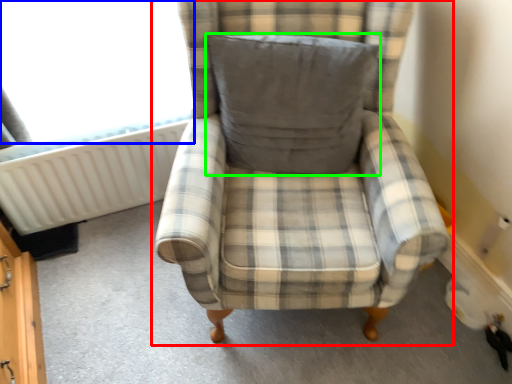
Question: Which object is the closest to the chair (highlighted by a red box)? Choose among these: window screen (highlighted by a blue box) or pillow (highlighted by a green box).

Choices:
 (A) window screen
 (B) pillow

Answer: (B)